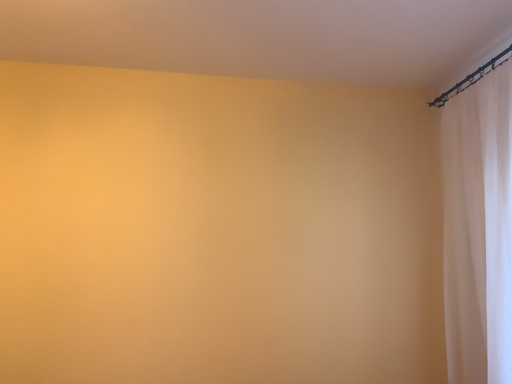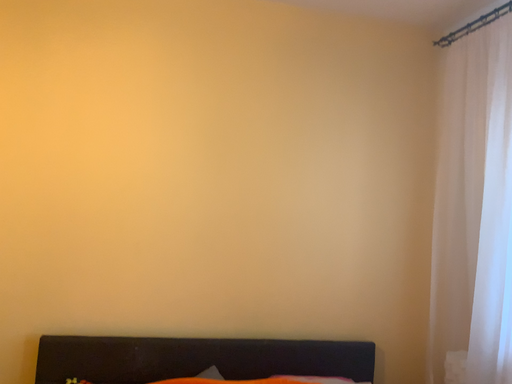
Question: How did the camera likely rotate when shooting the video?

Choices:
 (A) rotated downward
 (B) rotated upward

Answer: (A)